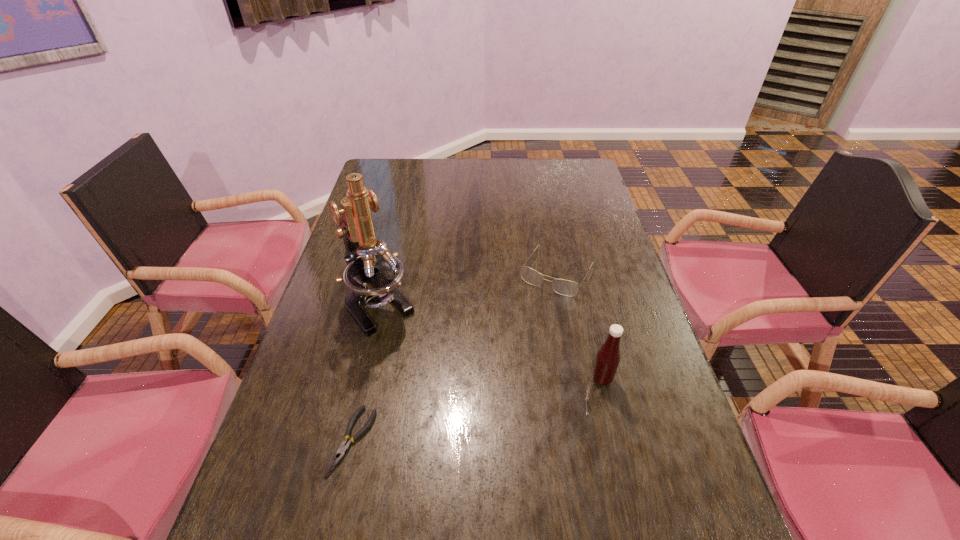
This screenshot has width=960, height=540. In order to click on the shortest object in this screenshot , I will do `click(345, 445)`.

Locate an element on the screen. The width and height of the screenshot is (960, 540). pliers is located at coordinates [345, 445].

Locate an element on the screen. The image size is (960, 540). the third farthest object is located at coordinates (607, 360).

The height and width of the screenshot is (540, 960). In order to click on the third shortest object in this screenshot , I will do `click(607, 360)`.

Where is `spectacles`? spectacles is located at coordinates (569, 288).

Image resolution: width=960 pixels, height=540 pixels. I want to click on the tallest object, so click(x=373, y=275).

Locate an element on the screen. The width and height of the screenshot is (960, 540). vacant space situated on the back of the shortest object is located at coordinates (384, 306).

What are the coordinates of `free space located 0.390m on the left of the second tallest object` in the screenshot? It's located at (427, 379).

Where is `blank space located 0.060m on the front-facing side of the second shortest object`? The height and width of the screenshot is (540, 960). blank space located 0.060m on the front-facing side of the second shortest object is located at coordinates (536, 308).

The width and height of the screenshot is (960, 540). What are the coordinates of `vacant space situated 0.340m on the front-facing side of the second shortest object` in the screenshot? It's located at (492, 384).